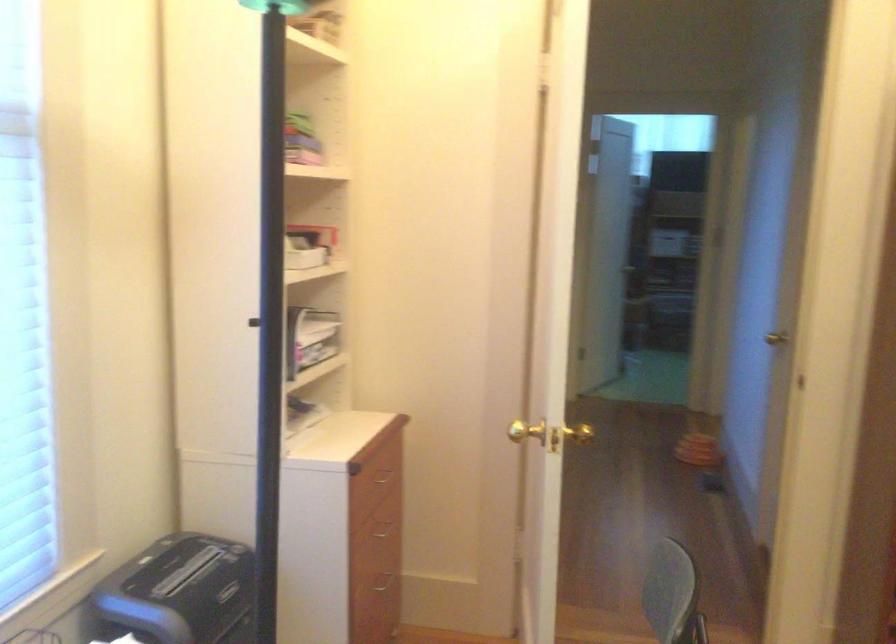
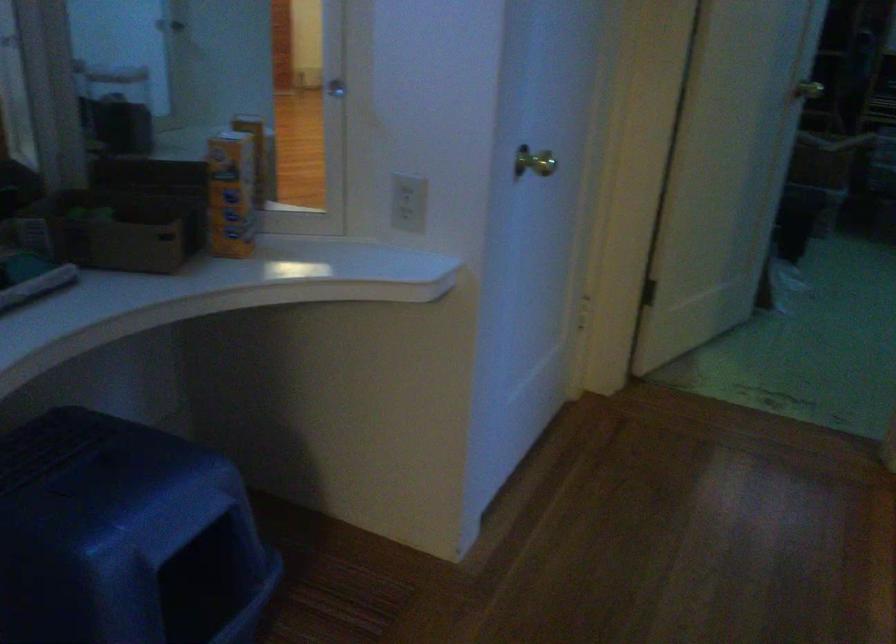
Question: Which direction would the cameraman need to move to produce the second image? Reply with the corresponding letter.

Choices:
 (A) Left
 (B) Right
 (C) Forward
 (D) Backward

Answer: (C)